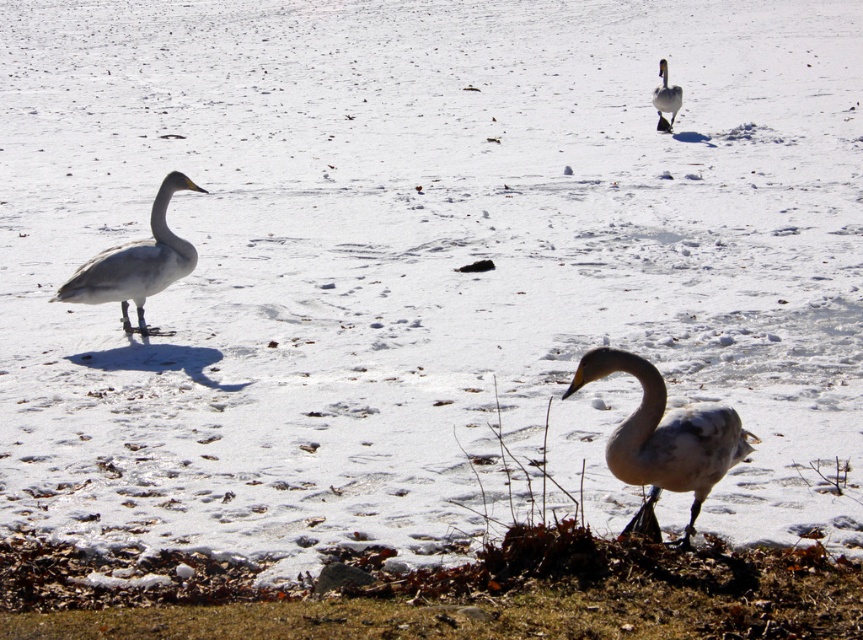
Can you confirm if white matte goose at lower center is bigger than white matte duck at upper center?

Indeed, white matte goose at lower center has a larger size compared to white matte duck at upper center.

The height and width of the screenshot is (640, 863). In order to click on white matte goose at lower center in this screenshot , I will do `click(665, 440)`.

Looking at this image, can you confirm if white matte goose at lower center is wider than white matte goose at left?

In fact, white matte goose at lower center might be narrower than white matte goose at left.

In the scene shown: Is white matte goose at lower center positioned at the back of white matte goose at left?

That is False.

This screenshot has height=640, width=863. Find the location of `white matte goose at lower center`. white matte goose at lower center is located at coordinates (665, 440).

Is the position of white matte goose at left more distant than that of white matte duck at upper center?

No, it is not.

Between white matte goose at left and white matte duck at upper center, which one appears on the left side from the viewer's perspective?

Positioned to the left is white matte goose at left.

Describe the element at coordinates (136, 262) in the screenshot. This screenshot has height=640, width=863. I see `white matte goose at left` at that location.

This screenshot has width=863, height=640. In order to click on white matte goose at left in this screenshot , I will do `click(136, 262)`.